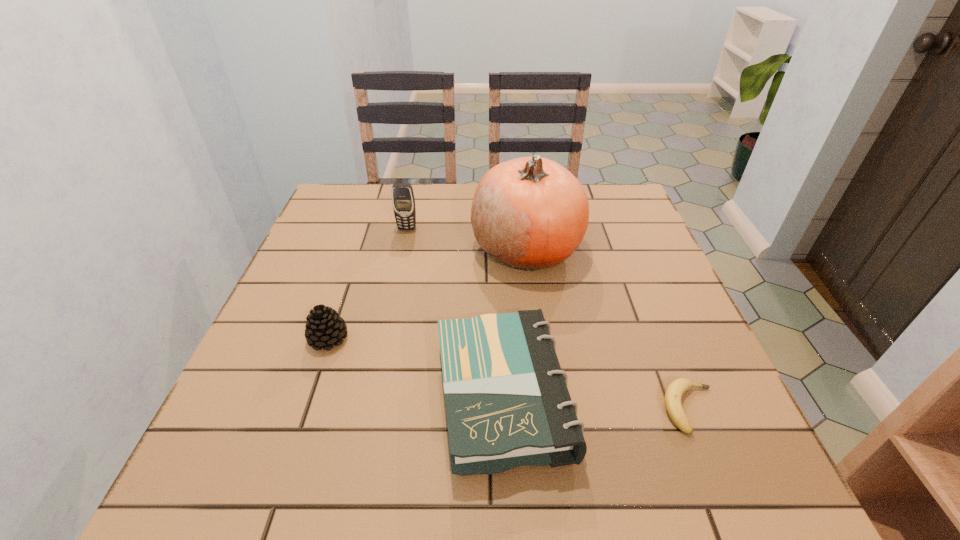
The width and height of the screenshot is (960, 540). In order to click on vacant space located on the left of the paperback book in this screenshot , I will do `click(248, 397)`.

Image resolution: width=960 pixels, height=540 pixels. I want to click on free space located 0.260m on the left of the rightmost object, so click(520, 408).

Identify the location of pumpkin that is positioned at the far edge. Image resolution: width=960 pixels, height=540 pixels. (530, 213).

Where is `cellular telephone at the far edge`? cellular telephone at the far edge is located at coordinates (403, 200).

Find the location of a particular element. This screenshot has width=960, height=540. object present at the near edge is located at coordinates (507, 403).

Locate an element on the screen. object positioned at the left edge is located at coordinates (324, 327).

The height and width of the screenshot is (540, 960). Identify the location of object situated at the right edge. (675, 390).

Where is `vacant space at the far edge`? Image resolution: width=960 pixels, height=540 pixels. vacant space at the far edge is located at coordinates (446, 196).

Where is `vacant space at the near edge of the desktop`? vacant space at the near edge of the desktop is located at coordinates (294, 504).

Find the location of a particular element. free region at the left edge of the desktop is located at coordinates (345, 296).